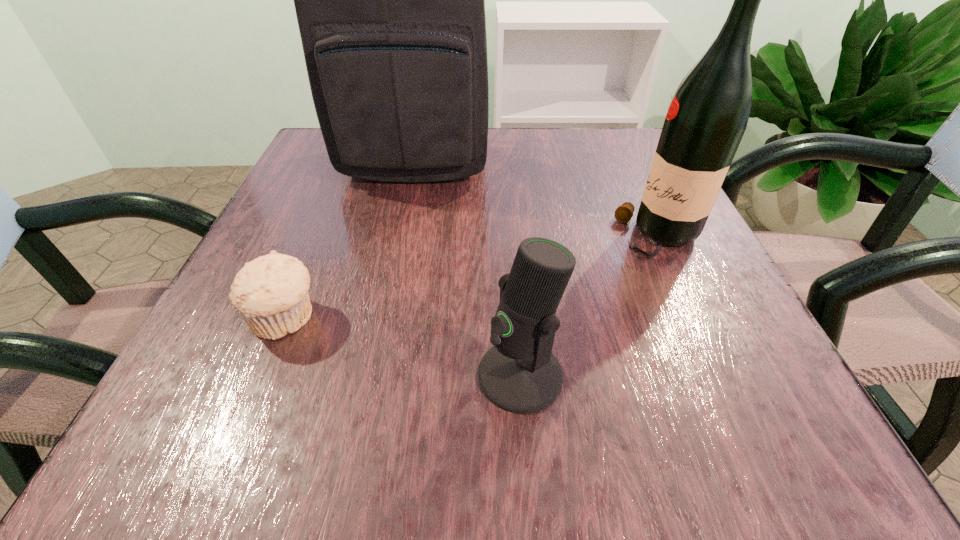
This screenshot has height=540, width=960. I want to click on object at the far edge, so click(x=390, y=0).

This screenshot has height=540, width=960. Find the location of `object situated at the near edge`. object situated at the near edge is located at coordinates (520, 374).

Identify the location of backpack located in the left edge section of the desktop. (390, 0).

The image size is (960, 540). Identify the location of muffin present at the left edge. (270, 293).

This screenshot has height=540, width=960. What are the coordinates of `object that is at the right edge` in the screenshot? It's located at (705, 122).

This screenshot has height=540, width=960. What are the coordinates of `object located in the far left corner section of the desktop` in the screenshot? It's located at (390, 0).

This screenshot has width=960, height=540. Identify the location of vacant space at the far edge of the desktop. (524, 144).

Where is `vacant space at the near edge of the desktop`? Image resolution: width=960 pixels, height=540 pixels. vacant space at the near edge of the desktop is located at coordinates (317, 446).

Where is `vacant space at the left edge of the desktop`? vacant space at the left edge of the desktop is located at coordinates (227, 335).

In the image, there is a desktop. Where is `vacant space at the right edge`? The height and width of the screenshot is (540, 960). vacant space at the right edge is located at coordinates (749, 350).